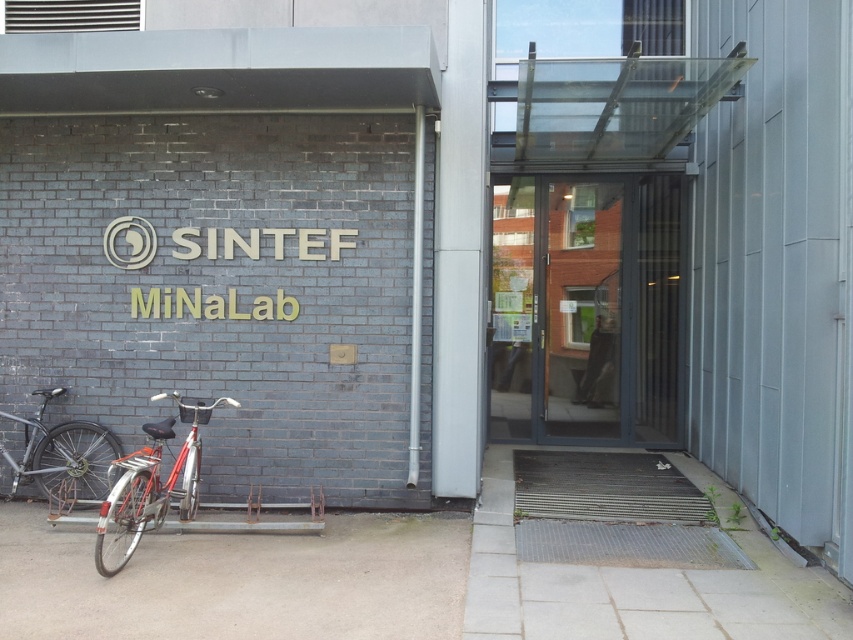
Question: Which point is farther from the camera taking this photo?

Choices:
 (A) (149, 433)
 (B) (84, 451)

Answer: (B)

Question: Is transparent glass door at center wider than shiny red bicycle at lower left?

Choices:
 (A) no
 (B) yes

Answer: (B)

Question: From the image, what is the correct spatial relationship of shiny red bicycle at lower left in relation to silver metallic bicycle at lower left?

Choices:
 (A) below
 (B) above

Answer: (A)

Question: Can you confirm if transparent glass door at center is wider than silver metallic bicycle at lower left?

Choices:
 (A) yes
 (B) no

Answer: (A)

Question: Which object is positioned farthest from the shiny red bicycle at lower left?

Choices:
 (A) transparent glass door at center
 (B) silver metallic bicycle at lower left

Answer: (A)

Question: Based on their relative distances, which object is nearer to the shiny red bicycle at lower left?

Choices:
 (A) transparent glass door at center
 (B) silver metallic bicycle at lower left

Answer: (B)